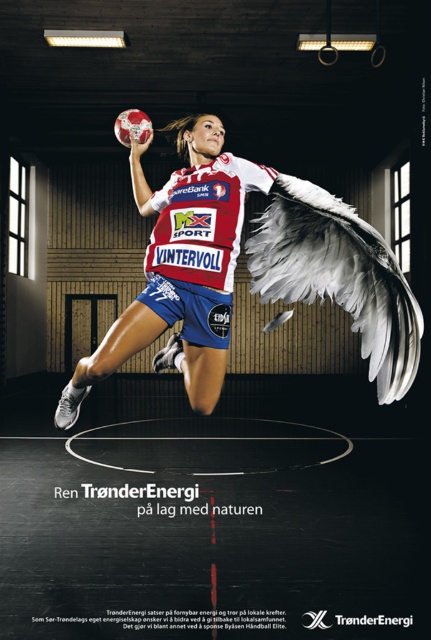
Which is below, matte white jersey at center or white feathered wing at upper center?

matte white jersey at center is lower down.

This screenshot has width=431, height=640. I want to click on matte white jersey at center, so click(x=249, y=269).

Does white feathered wing at upper center appear under white jersey at center?

Correct, white feathered wing at upper center is located below white jersey at center.

Who is positioned more to the left, white feathered wing at upper center or white jersey at center?

Positioned to the left is white jersey at center.

Which is behind, point (277, 205) or point (221, 211)?

The point (221, 211) is more distant.

Where is `white feathered wing at upper center`? This screenshot has width=431, height=640. white feathered wing at upper center is located at coordinates (339, 275).

From the picture: Is matte white jersey at center to the left of white jersey at center from the viewer's perspective?

Yes, matte white jersey at center is to the left of white jersey at center.

Locate an element on the screen. matte white jersey at center is located at coordinates (249, 269).